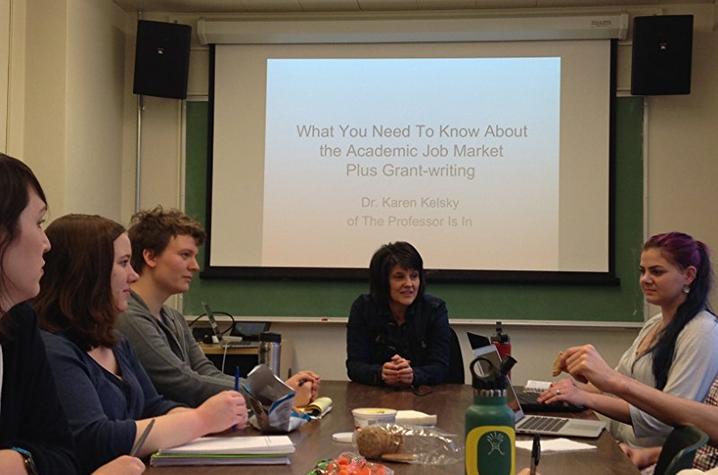
Locate an element on the screen. The height and width of the screenshot is (475, 718). screen is located at coordinates (584, 164).